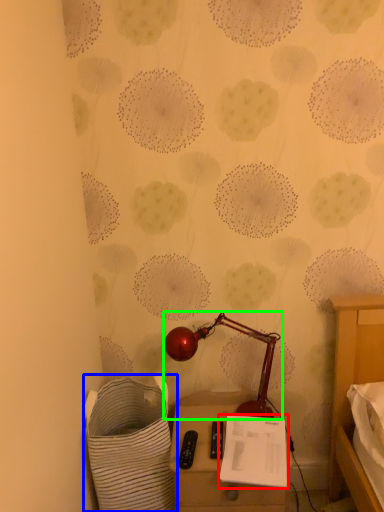
Question: Which is nearer to the notepad (highlighted by a red box)? laundry basket (highlighted by a blue box) or lamp (highlighted by a green box).

Choices:
 (A) laundry basket
 (B) lamp

Answer: (B)